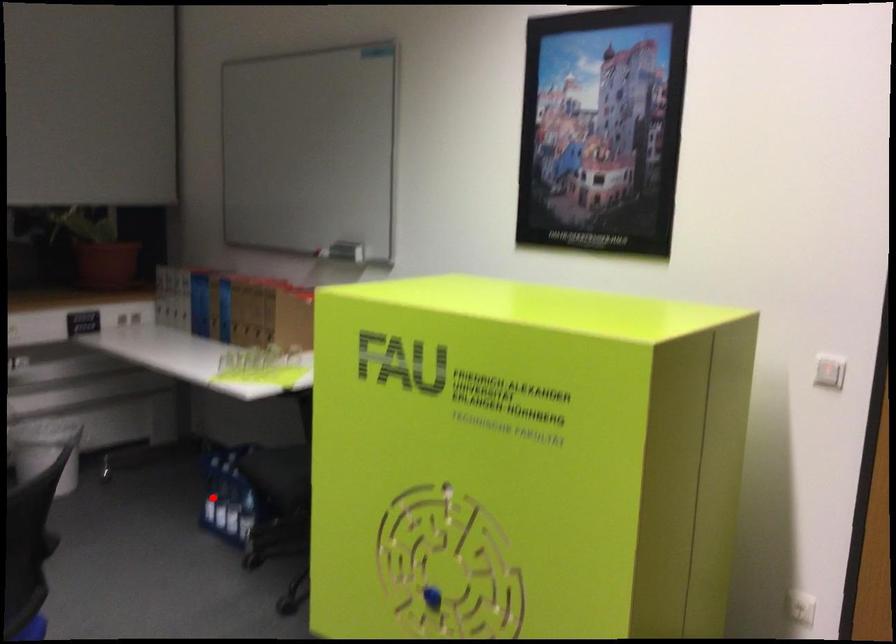
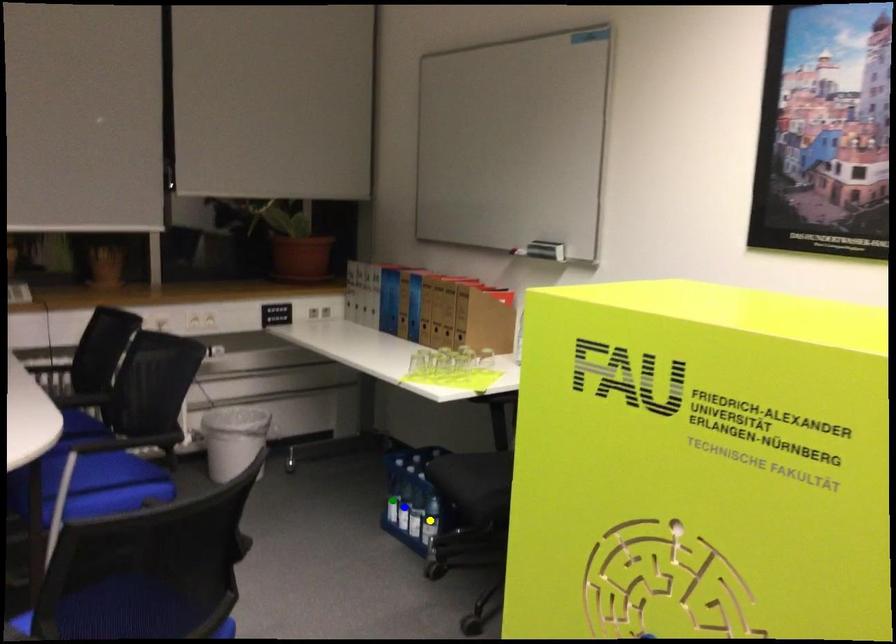
Question: I am providing you with two images of the same scene from different viewpoints. A red point is marked on the first image. You are given multiple points on the second image. Which point in image 2 represents the same 3d spot as the red point in image 1?

Choices:
 (A) green point
 (B) yellow point
 (C) blue point

Answer: (A)